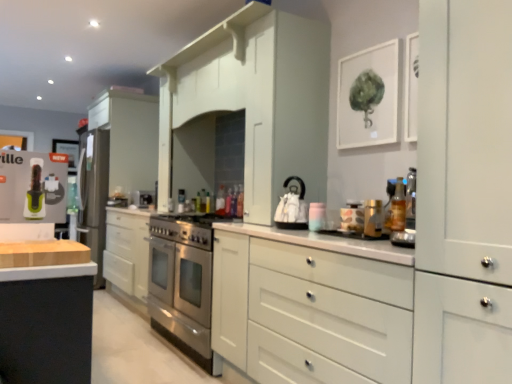
Question: Which direction should I rotate to face white glossy kettle at center, the 2th appliance in the front-to-back sequence, — up or down?

Choices:
 (A) down
 (B) up

Answer: (A)

Question: Is green plastic appliance at left thinner than stainless steel gas stove at center?

Choices:
 (A) no
 (B) yes

Answer: (B)

Question: Does green plastic appliance at left have a smaller size compared to stainless steel gas stove at center?

Choices:
 (A) yes
 (B) no

Answer: (A)

Question: From the image's perspective, is green plastic appliance at left under stainless steel gas stove at center?

Choices:
 (A) no
 (B) yes

Answer: (A)

Question: Does green plastic appliance at left appear on the left side of stainless steel gas stove at center?

Choices:
 (A) no
 (B) yes

Answer: (B)

Question: Is the depth of green plastic appliance at left less than that of stainless steel gas stove at center?

Choices:
 (A) no
 (B) yes

Answer: (B)

Question: Would you consider green plastic appliance at left to be distant from stainless steel gas stove at center?

Choices:
 (A) no
 (B) yes

Answer: (B)

Question: Considering the relative sizes of matte white jar at center, marked as the 1th appliance in a front-to-back arrangement, and stainless steel gas stove at center in the image provided, is matte white jar at center, marked as the 1th appliance in a front-to-back arrangement, taller than stainless steel gas stove at center?

Choices:
 (A) yes
 (B) no

Answer: (A)

Question: Can you confirm if matte white jar at center, marked as the 1th appliance in a front-to-back arrangement, is wider than stainless steel gas stove at center?

Choices:
 (A) yes
 (B) no

Answer: (B)

Question: Does matte white jar at center, the fourth appliance when ordered from left to right, have a lesser width compared to stainless steel gas stove at center?

Choices:
 (A) no
 (B) yes

Answer: (B)

Question: From the image's perspective, is matte white jar at center, the fourth appliance viewed from the back, over stainless steel gas stove at center?

Choices:
 (A) yes
 (B) no

Answer: (A)

Question: From a real-world perspective, is matte white jar at center, marked as the 1th appliance in a front-to-back arrangement, on stainless steel gas stove at center?

Choices:
 (A) no
 (B) yes

Answer: (B)

Question: Is stainless steel gas stove at center surrounded by matte white jar at center, the first appliance when ordered from right to left?

Choices:
 (A) no
 (B) yes

Answer: (A)

Question: From a real-world perspective, is wooden at left physically above satin silver refrigerator at left, which is counted as the 1th appliance, starting from the left?

Choices:
 (A) yes
 (B) no

Answer: (B)